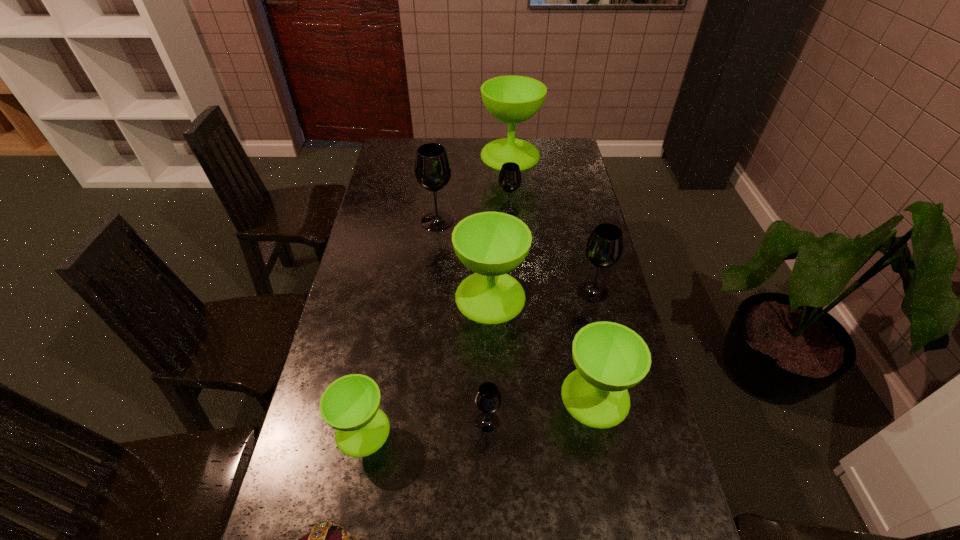
This screenshot has height=540, width=960. In order to click on free location located on the back of the nearest gray wineglass in this screenshot , I will do `click(487, 393)`.

In order to click on object located in the far edge section of the desktop in this screenshot , I will do coord(512,99).

Where is `object positioned at the left edge`? object positioned at the left edge is located at coordinates (350, 404).

Where is `vacant space at the far edge`? vacant space at the far edge is located at coordinates (468, 158).

In the image, there is a desktop. Where is `vacant space at the left edge`? The image size is (960, 540). vacant space at the left edge is located at coordinates (388, 213).

What are the coordinates of `vacant space at the right edge` in the screenshot? It's located at (596, 450).

Identify the location of vacant space at the far left corner of the desktop. (383, 160).

Where is `vacant area that lies between the second biggest gray wineglass and the biggest green wineglass`? This screenshot has height=540, width=960. vacant area that lies between the second biggest gray wineglass and the biggest green wineglass is located at coordinates (551, 224).

Find the location of a particular element. free spot between the nearest gray wineglass and the leftmost gray wineglass is located at coordinates (463, 322).

Where is `vacant area that lies between the biggest gray wineglass and the farthest object`? The width and height of the screenshot is (960, 540). vacant area that lies between the biggest gray wineglass and the farthest object is located at coordinates (473, 188).